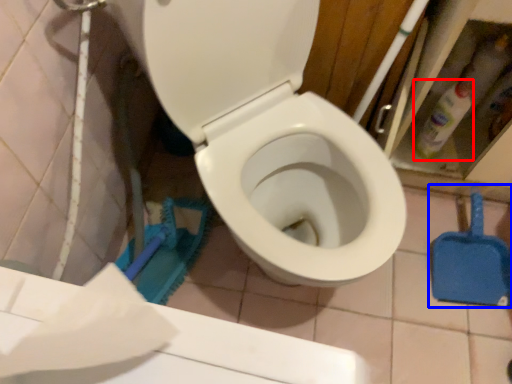
Question: Which object appears farthest to the camera in this image, cleaning product (highlighted by a red box) or shovel (highlighted by a blue box)?

Choices:
 (A) cleaning product
 (B) shovel

Answer: (B)